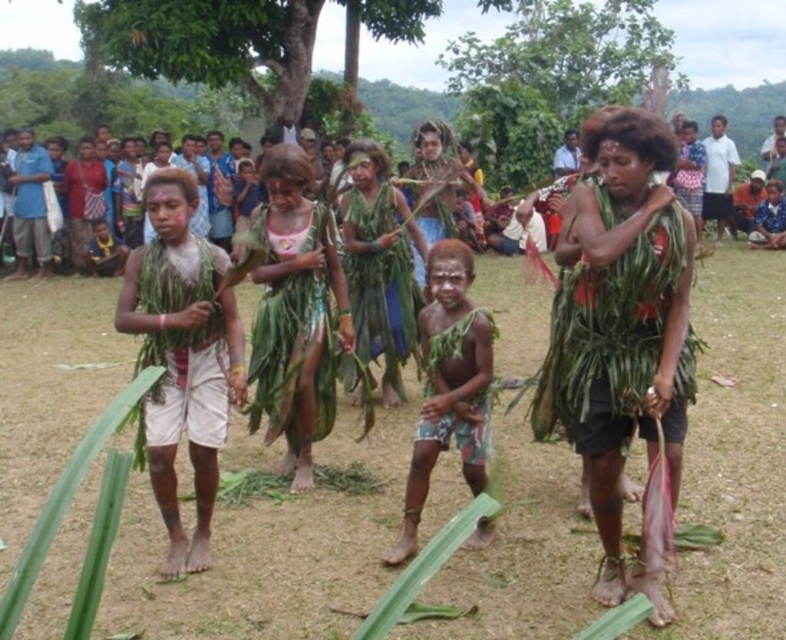
You are a photographer standing in front of the scene. You want to take a photo that includes both the green leafy grass at center and the brown textured cloth at center. Which object should you focus on first to ensure both are in clear view?

The green leafy grass at center is closer to the viewer than the brown textured cloth at center, so you should focus on the green leafy grass at center first to ensure both are in clear view.

You are a photographer trying to capture the scene from the front. You want to ensure that both the green leafy grass at center and the brown textured cloth at center are visible in your shot. Which object should you position closer to the left side of the frame?

The green leafy grass at center should be positioned closer to the left side of the frame since it is located to the left of the brown textured cloth at center.

You are a dancer in the performance and need to step on the green leafy grass at center or the brown textured cloth at center. Which one is wider to stand on comfortably?

The green leafy grass at center might be wider than brown textured cloth at center, so it is more suitable for standing comfortably.